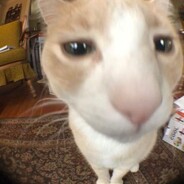
This screenshot has width=184, height=184. I want to click on white fur, so click(92, 100), click(96, 138).